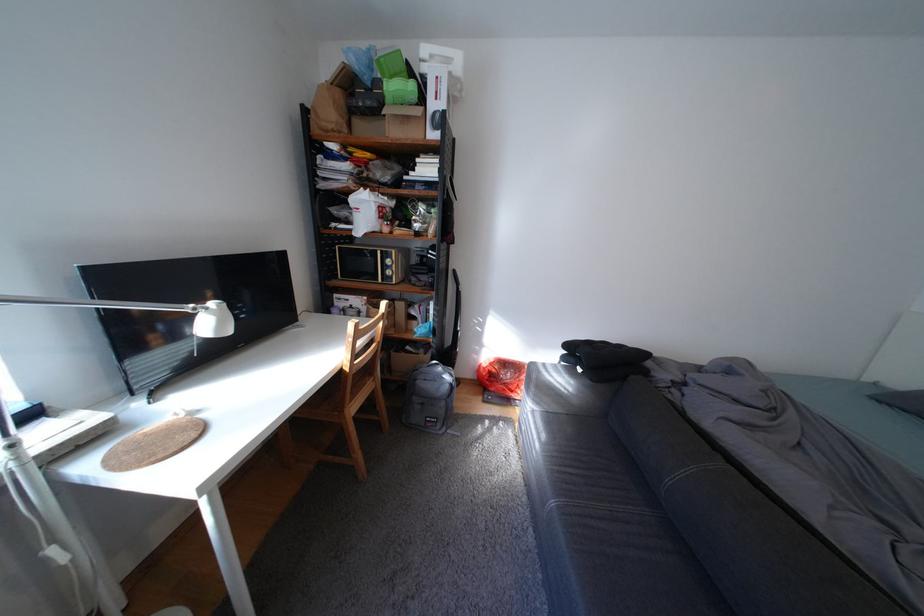
Where is `rolled-up fabric`? rolled-up fabric is located at coordinates (818, 471).